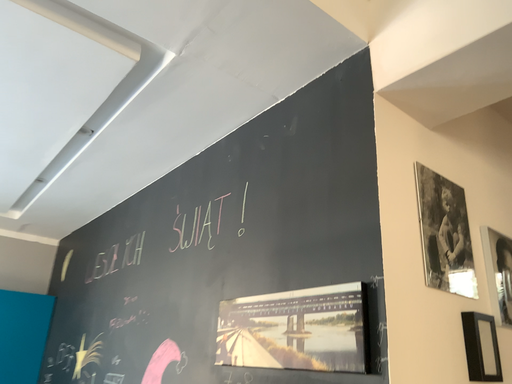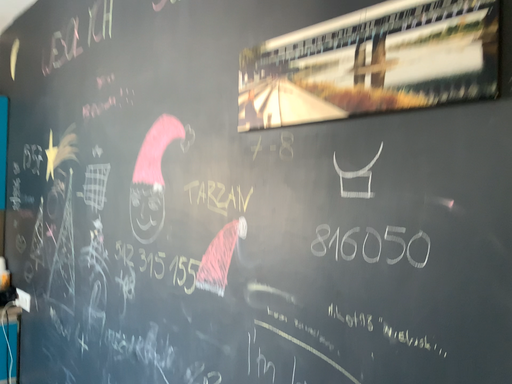
Question: How did the camera likely rotate when shooting the video?

Choices:
 (A) rotated downward
 (B) rotated upward

Answer: (A)